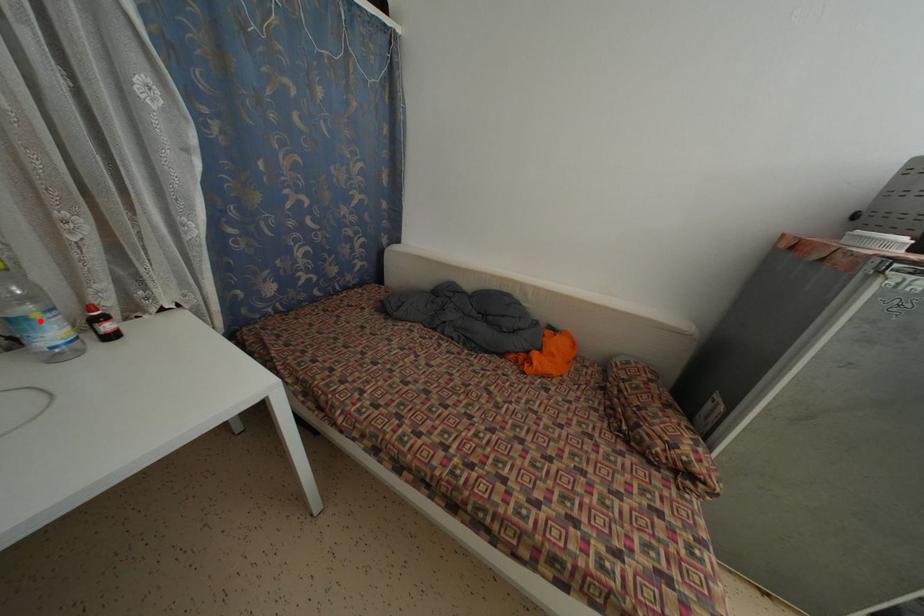
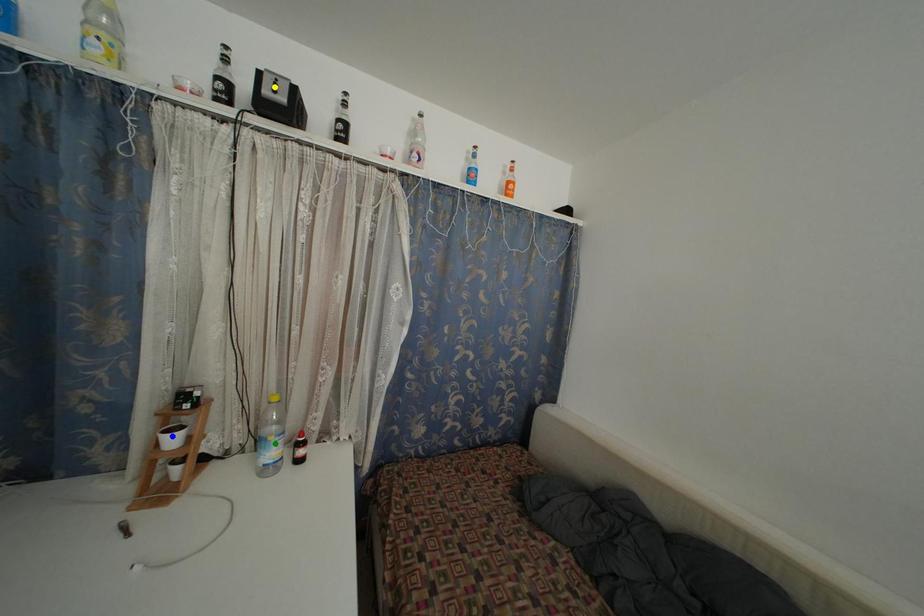
Question: I am providing you with two images of the same scene from different viewpoints. A red point is marked on the first image. You are given multiple points on the second image. In image 2, which mark is for the same physical point as the one in image 1?

Choices:
 (A) blue point
 (B) yellow point
 (C) green point

Answer: (C)